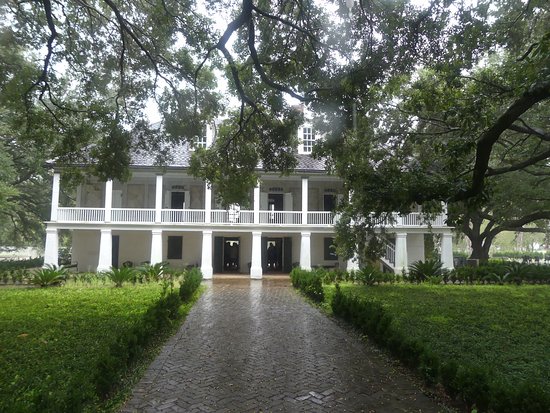
This screenshot has width=550, height=413. I want to click on stairway, so click(x=385, y=256).